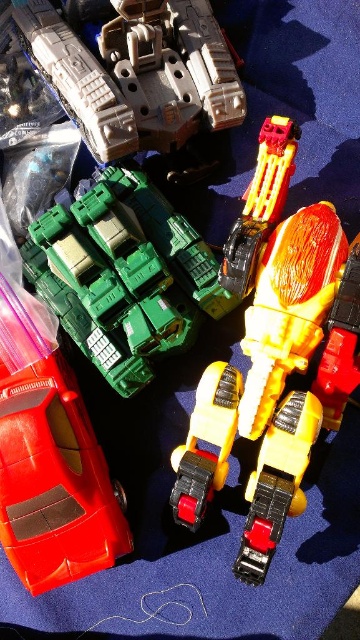
Between point (186, 17) and point (11, 545), which one is positioned behind?

The point (186, 17) is more distant.

Can you confirm if matte plastic robot at upper left is smaller than shiny red car at lower left?

Incorrect, matte plastic robot at upper left is not smaller in size than shiny red car at lower left.

Is point (181, 22) positioned before point (12, 552)?

No, (181, 22) is behind (12, 552).

Find the location of a particular element. The image size is (360, 640). matte plastic robot at upper left is located at coordinates (132, 72).

Between shiny plastic car at center and yellow matte truck at center, which one appears on the right side from the viewer's perspective?

Positioned to the right is shiny plastic car at center.

Who is more distant from viewer, (241,576) or (187,493)?

Positioned behind is point (187,493).

Where is `shiny plastic car at center`? This screenshot has height=640, width=360. shiny plastic car at center is located at coordinates (276, 483).

Is matte plastic robot at upper left above shiny plastic robot at center?

Correct, matte plastic robot at upper left is located above shiny plastic robot at center.

Image resolution: width=360 pixels, height=640 pixels. What do you see at coordinates (132, 72) in the screenshot?
I see `matte plastic robot at upper left` at bounding box center [132, 72].

Which is behind, point (75, 100) or point (335, 406)?

Positioned behind is point (75, 100).

Find the location of a particular element. This screenshot has width=360, height=640. matte plastic robot at upper left is located at coordinates (132, 72).